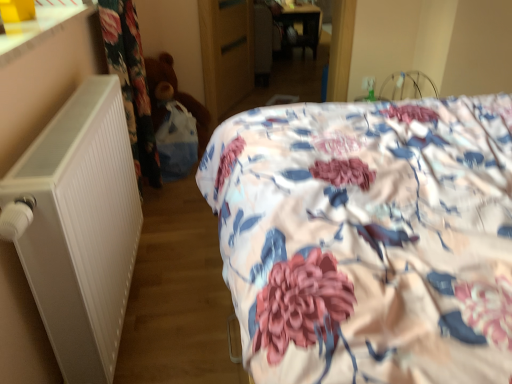
Question: Is wooden wardrobe at center smaller than brown plush teddy bear at left?

Choices:
 (A) yes
 (B) no

Answer: (A)

Question: Is wooden wardrobe at center with brown plush teddy bear at left?

Choices:
 (A) yes
 (B) no

Answer: (B)

Question: Does wooden wardrobe at center appear on the right side of brown plush teddy bear at left?

Choices:
 (A) yes
 (B) no

Answer: (A)

Question: Is wooden wardrobe at center in front of brown plush teddy bear at left?

Choices:
 (A) no
 (B) yes

Answer: (A)

Question: From the image's perspective, would you say wooden wardrobe at center is shown under brown plush teddy bear at left?

Choices:
 (A) yes
 (B) no

Answer: (B)

Question: From the image's perspective, is wooden wardrobe at center located above brown plush teddy bear at left?

Choices:
 (A) no
 (B) yes

Answer: (B)

Question: From a real-world perspective, is floral fabric bed at center located higher than wooden wardrobe at center?

Choices:
 (A) no
 (B) yes

Answer: (B)

Question: Is floral fabric bed at center wider than wooden wardrobe at center?

Choices:
 (A) yes
 (B) no

Answer: (A)

Question: Does floral fabric bed at center lie in front of wooden wardrobe at center?

Choices:
 (A) yes
 (B) no

Answer: (A)

Question: From a real-world perspective, is floral fabric bed at center under wooden wardrobe at center?

Choices:
 (A) yes
 (B) no

Answer: (B)

Question: From the image's perspective, is floral fabric bed at center located above wooden wardrobe at center?

Choices:
 (A) yes
 (B) no

Answer: (B)

Question: Is floral fabric bed at center aimed at wooden wardrobe at center?

Choices:
 (A) yes
 (B) no

Answer: (A)

Question: Is white matte radiator at left outside wooden wardrobe at center?

Choices:
 (A) yes
 (B) no

Answer: (A)